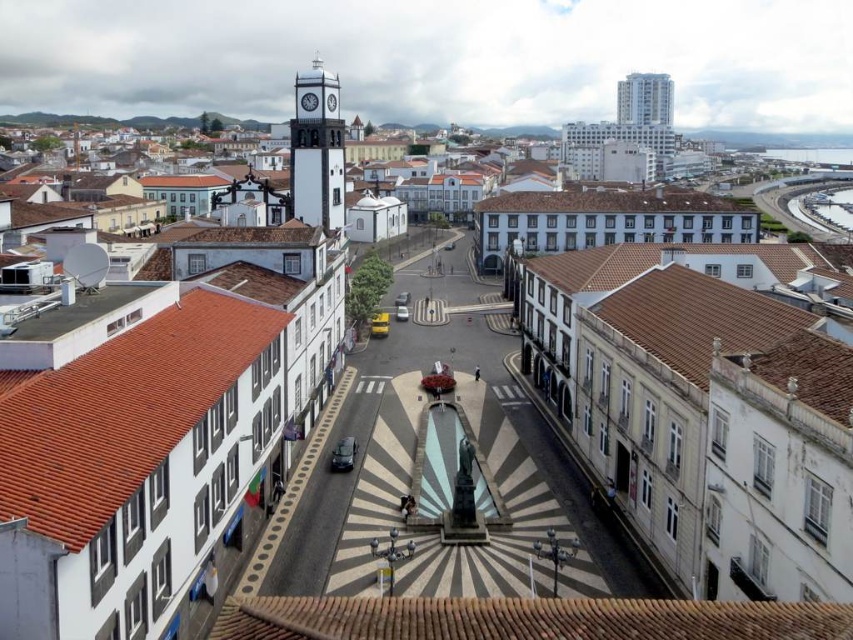
You are standing on a rooftop overlooking the plaza. You notice two points in the scene, one at coordinates point (308, 108) and another at point (329, 97). Which point is closer to your current position?

Point (308, 108) is closer to the camera than point (329, 97), so the point at coordinates point (308, 108) is closer to your current position.